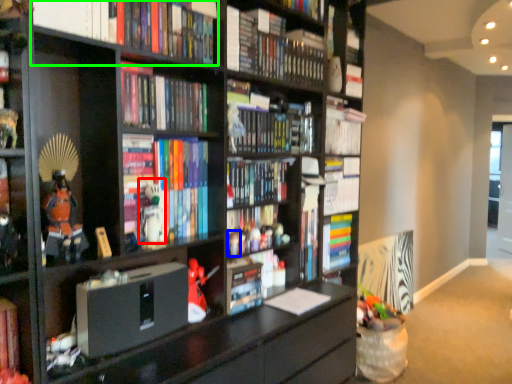
Question: Considering the real-world distances, which object is farthest from toy (highlighted by a red box)? toy (highlighted by a blue box) or book (highlighted by a green box)?

Choices:
 (A) toy
 (B) book

Answer: (B)